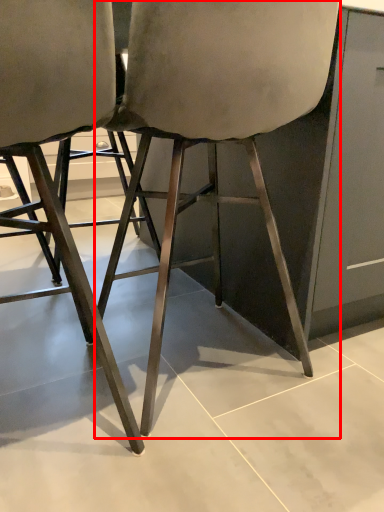
Question: In this image, where is chair (annotated by the red box) located relative to chair?

Choices:
 (A) right
 (B) left

Answer: (A)